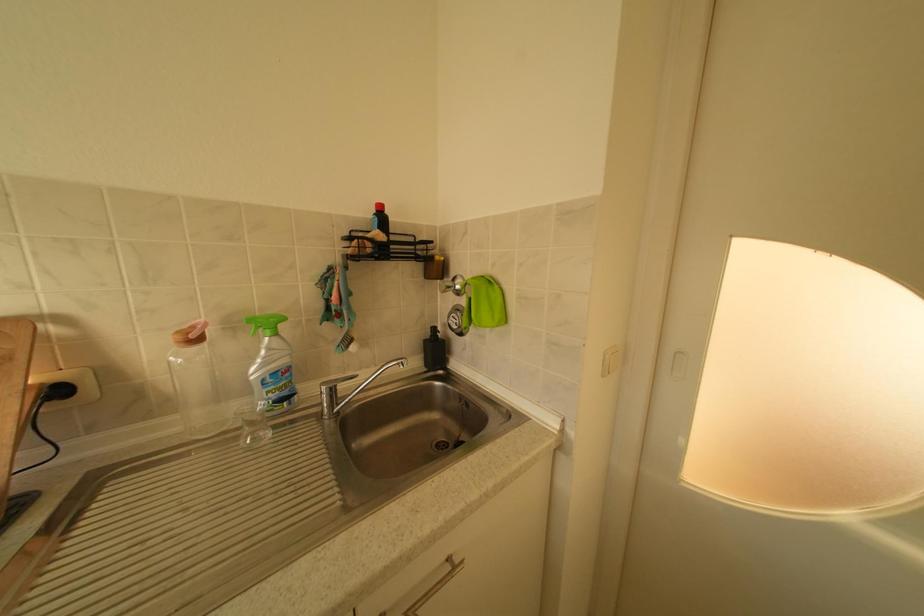
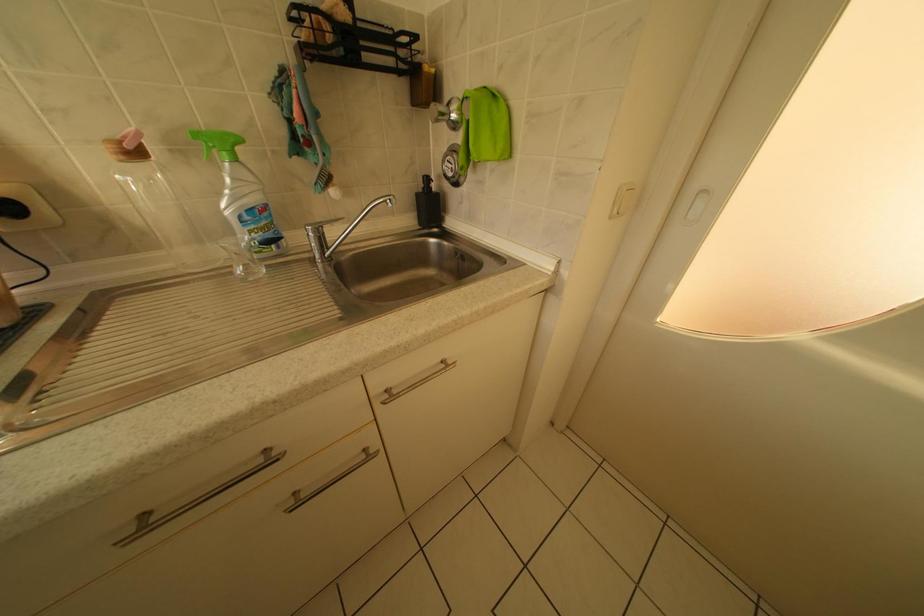
What movement of the cameraman would produce the second image?

The movement direction of the cameraman is right, forward.